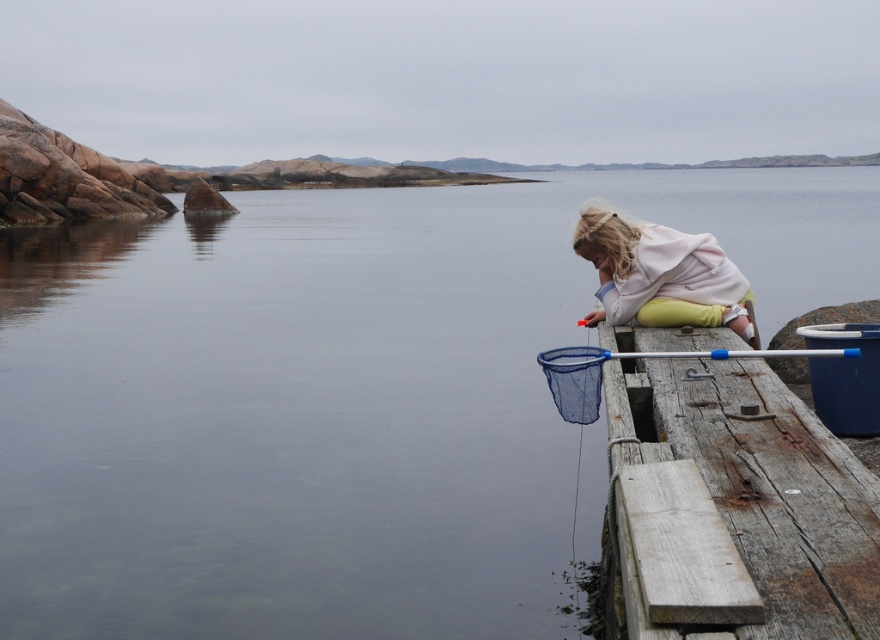
Consider the image. You are a photographer trying to capture the weathered wood dock at lower right and the blue plastic fishing pole at right in the same frame. Based on their positions, which object should you adjust your camera to focus on first to ensure both are in the shot?

The weathered wood dock at lower right is positioned on the left side of blue plastic fishing pole at right, so you should focus on the weathered wood dock at lower right first to ensure both are in the frame.

You are a marine biologist studying water levels in the bay. You observe the clear water at dock right and the weathered wood dock at lower right. Which object has a greater height in this scene?

The clear water at dock right has a greater height than the weathered wood dock at lower right according to the description.

You are a photographer aiming to capture the light pink fleece at right and the blue plastic fishing pole at right in the same frame. Since both are at the right side of the image, will you need to adjust your camera angle to include both?

The light pink fleece at right is positioned over the blue plastic fishing pole at right, so you can capture both in the same frame without adjusting the camera angle as they are stacked vertically on the right side.